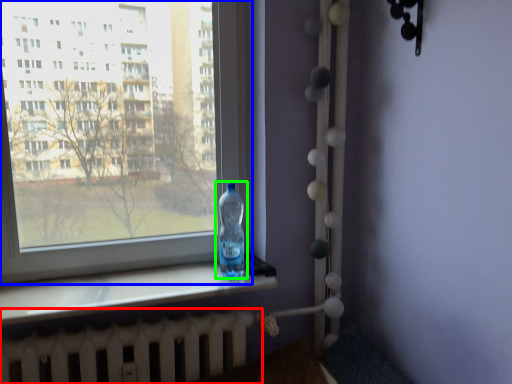
Question: Estimate the real-world distances between objects in this image. Which object is farther from radiator (highlighted by a red box), window (highlighted by a blue box) or bottle (highlighted by a green box)?

Choices:
 (A) window
 (B) bottle

Answer: (B)